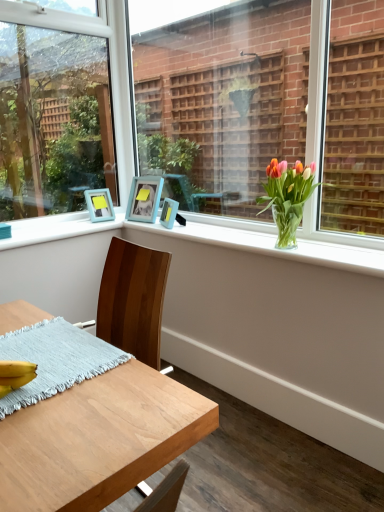
Question: Is translucent glass vase at upper right located within clear glass vase at center, which is the 1th window from right to left?

Choices:
 (A) no
 (B) yes

Answer: (A)

Question: Can you confirm if clear glass vase at center, which is the 2th window in left-to-right order, is positioned to the left of translucent glass vase at upper right?

Choices:
 (A) no
 (B) yes

Answer: (B)

Question: Does clear glass vase at center, which is the 2th window in left-to-right order, appear on the right side of translucent glass vase at upper right?

Choices:
 (A) yes
 (B) no

Answer: (B)

Question: Is clear glass vase at center, which is the 1th window from right to left, positioned with its back to translucent glass vase at upper right?

Choices:
 (A) no
 (B) yes

Answer: (B)

Question: Considering the relative sizes of clear glass vase at center, which is the 2th window in left-to-right order, and translucent glass vase at upper right in the image provided, is clear glass vase at center, which is the 2th window in left-to-right order, shorter than translucent glass vase at upper right?

Choices:
 (A) no
 (B) yes

Answer: (A)

Question: Does clear glass vase at center, which is the 1th window from right to left, have a lesser width compared to translucent glass vase at upper right?

Choices:
 (A) yes
 (B) no

Answer: (A)

Question: Is translucent glass vase at upper right thinner than blue matte picture frame at upper center, which appears as the 2th picture frame when viewed from the right?

Choices:
 (A) yes
 (B) no

Answer: (B)

Question: Are translucent glass vase at upper right and blue matte picture frame at upper center, the second picture frame viewed from the left, beside each other?

Choices:
 (A) no
 (B) yes

Answer: (A)

Question: From a real-world perspective, is translucent glass vase at upper right below blue matte picture frame at upper center, which appears as the 2th picture frame when viewed from the right?

Choices:
 (A) yes
 (B) no

Answer: (B)

Question: Is translucent glass vase at upper right positioned beyond the bounds of blue matte picture frame at upper center, the second picture frame viewed from the left?

Choices:
 (A) no
 (B) yes

Answer: (B)

Question: Can you confirm if translucent glass vase at upper right is shorter than blue matte picture frame at upper center, which appears as the 2th picture frame when viewed from the right?

Choices:
 (A) yes
 (B) no

Answer: (B)

Question: From the image's perspective, is translucent glass vase at upper right beneath blue matte picture frame at upper center, which appears as the 2th picture frame when viewed from the right?

Choices:
 (A) no
 (B) yes

Answer: (B)

Question: Is clear glass vase at upper center positioned with its back to matte blue picture frame at upper center, which is the 1th picture frame in right-to-left order?

Choices:
 (A) no
 (B) yes

Answer: (A)